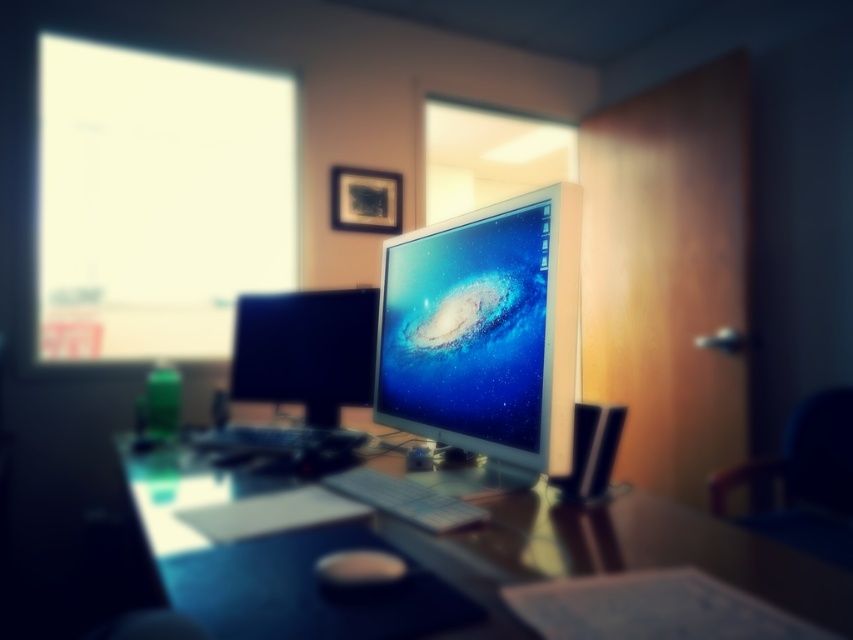
Is smooth wooden desk at center to the right of white plastic keyboard at center from the viewer's perspective?

No, smooth wooden desk at center is not to the right of white plastic keyboard at center.

Can you confirm if smooth wooden desk at center is taller than white plastic keyboard at center?

Indeed, smooth wooden desk at center has a greater height compared to white plastic keyboard at center.

You are a GUI agent. You are given a task and a screenshot of the screen. Output one action in this format:
    pyautogui.click(x=<x>, y=<y>)
    Task: Click on the smooth wooden desk at center
    This screenshot has height=640, width=853.
    Given the screenshot: What is the action you would take?
    pyautogui.click(x=457, y=552)

Can you confirm if satin silver monitor at center is positioned to the left of black glossy monitor at center?

No, satin silver monitor at center is not to the left of black glossy monitor at center.

Between point (527, 380) and point (316, 371), which one is positioned behind?

Point (316, 371)

The width and height of the screenshot is (853, 640). I want to click on satin silver monitor at center, so click(485, 330).

Is point (497, 362) behind point (412, 486)?

No.

Who is taller, satin silver monitor at center or white plastic keyboard at center?

satin silver monitor at center is taller.

Who is more distant from viewer, (x=381, y=342) or (x=433, y=490)?

Point (x=381, y=342)

Find the location of a particular element. satin silver monitor at center is located at coordinates (485, 330).